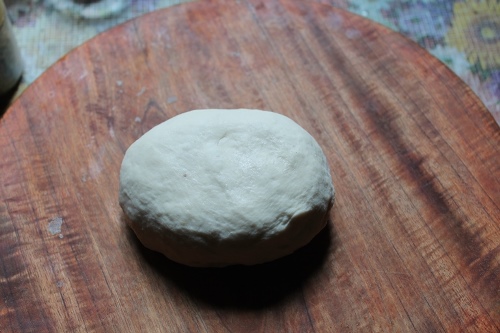
This screenshot has height=333, width=500. What are the coordinates of `table top` in the screenshot? It's located at (50, 29), (406, 13), (477, 77), (144, 5).